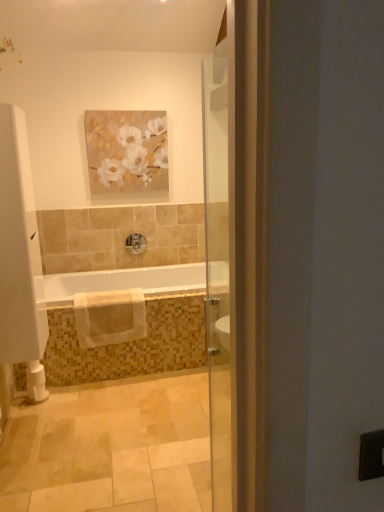
Question: From the image's perspective, relative to beige cotton towel at lower center, is matte floral painting at upper center above or below?

Choices:
 (A) below
 (B) above

Answer: (B)

Question: Relative to beige cotton towel at lower center, is matte floral painting at upper center in front or behind?

Choices:
 (A) front
 (B) behind

Answer: (B)

Question: Which object is positioned closest to the beige cotton towel at lower center?

Choices:
 (A) white towel at center
 (B) white glossy bathtub at center
 (C) matte floral painting at upper center
 (D) satin nickel faucet at center

Answer: (A)

Question: Estimate the real-world distances between objects in this image. Which object is closer to the matte floral painting at upper center?

Choices:
 (A) satin nickel faucet at center
 (B) white towel at center
 (C) white glossy bathtub at center
 (D) beige cotton towel at lower center

Answer: (A)